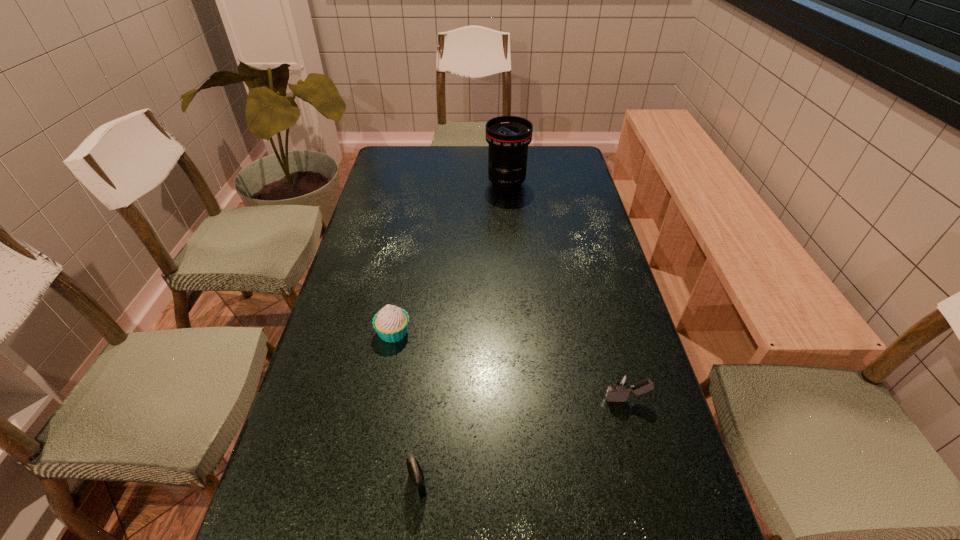
This screenshot has width=960, height=540. Find the location of `vacant space in between the third object from right to left and the second farthest object`. vacant space in between the third object from right to left and the second farthest object is located at coordinates (406, 408).

In order to click on vacant region between the rightmost object and the nearest object in this screenshot , I will do `click(522, 441)`.

Find the location of a particular element. The width and height of the screenshot is (960, 540). free space between the third object from right to left and the third farthest object is located at coordinates (522, 441).

Find the location of `free space between the nearest object and the second object from right to left`. free space between the nearest object and the second object from right to left is located at coordinates (463, 334).

Where is `vacant space that is in between the second object from left to right and the rightmost object`? This screenshot has width=960, height=540. vacant space that is in between the second object from left to right and the rightmost object is located at coordinates (522, 441).

You are a GUI agent. You are given a task and a screenshot of the screen. Output one action in this format:
    pyautogui.click(x=<x>, y=<y>)
    Task: Click on the unoccupied area between the cupcake and the padlock
    The image size is (960, 540).
    Given the screenshot: What is the action you would take?
    pyautogui.click(x=406, y=408)

The image size is (960, 540). I want to click on vacant area that lies between the nearest object and the igniter, so click(x=522, y=441).

The height and width of the screenshot is (540, 960). Find the location of `object that stands as the second closest to the padlock`. object that stands as the second closest to the padlock is located at coordinates (621, 385).

You are a GUI agent. You are given a task and a screenshot of the screen. Output one action in this format:
    pyautogui.click(x=<x>, y=<y>)
    Task: Click on the object that is the second closest to the igniter
    The width and height of the screenshot is (960, 540).
    Given the screenshot: What is the action you would take?
    pyautogui.click(x=391, y=323)

Find the location of a particular element. blank area in the image that satisfies the following two spatial constraints: 1. on the back side of the third nearest object; 2. on the left side of the farthest object is located at coordinates (420, 184).